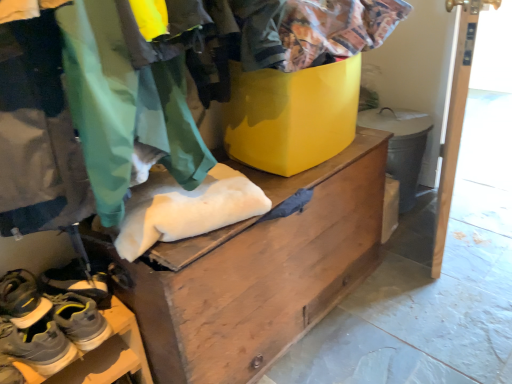
Locate an element on the screen. Image resolution: width=512 pixels, height=384 pixels. unoccupied region to the right of white wood door at right is located at coordinates (479, 225).